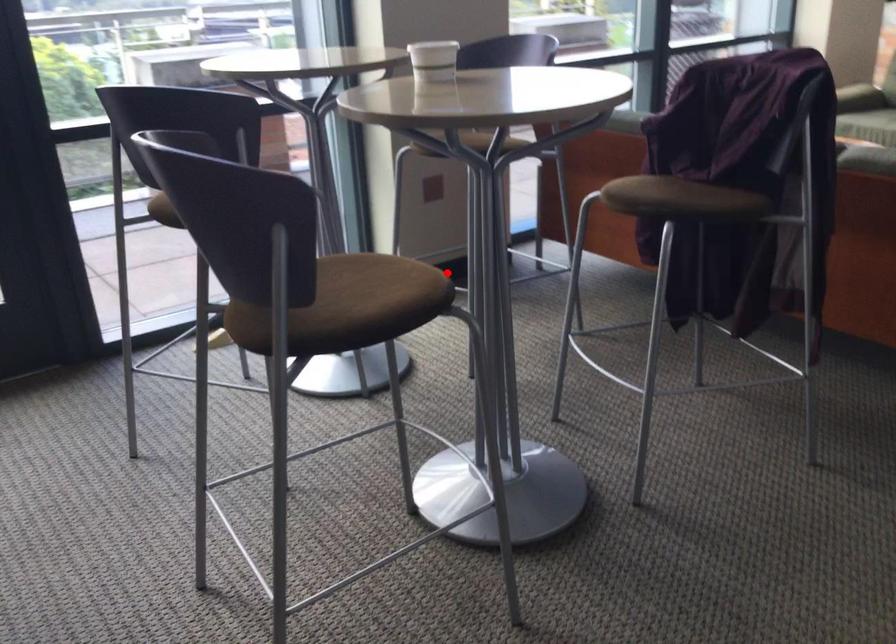
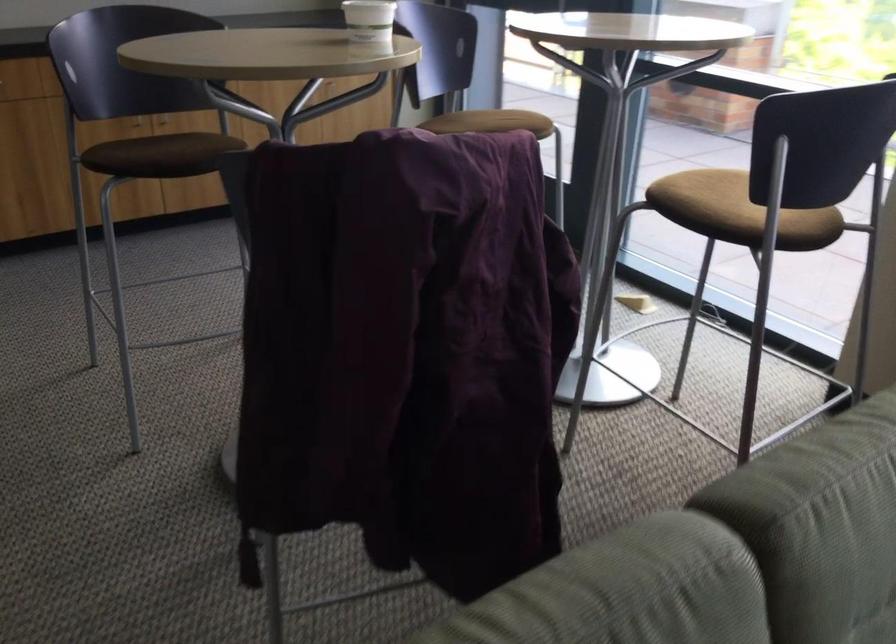
Find the pixel in the second image that matches the highlighted location in the first image.

(173, 160)